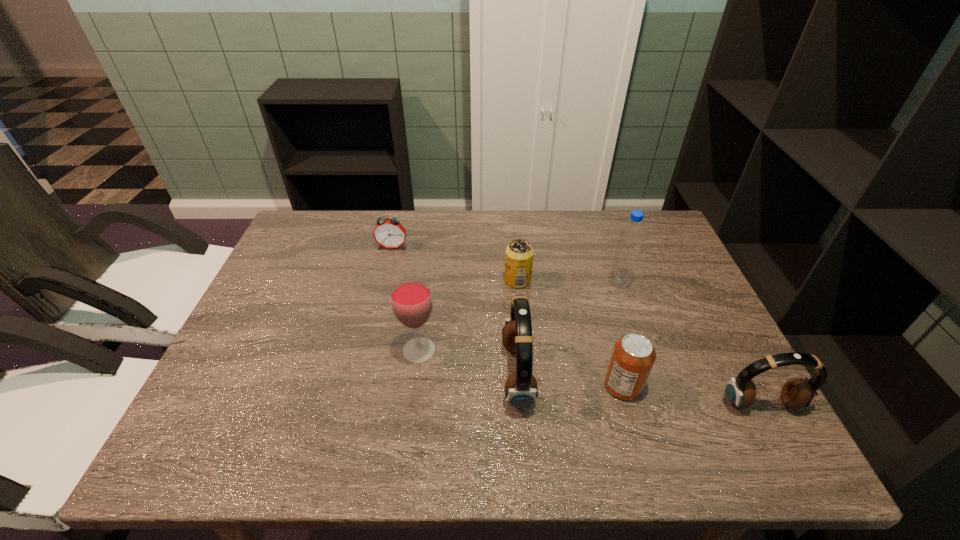
Locate an element on the screen. unoccupied area between the water bottle and the taller headset is located at coordinates (568, 329).

Where is `object that is the third closest to the beer can`? The height and width of the screenshot is (540, 960). object that is the third closest to the beer can is located at coordinates (411, 298).

Locate which object ranks third in proximity to the can. Please provide its 2D coordinates. Your answer should be formatted as a tuple, i.e. [(x, y)], where the tuple contains the x and y coordinates of a point satisfying the conditions above.

[(631, 237)]

The height and width of the screenshot is (540, 960). Find the location of `free space in the image that satisfies the following two spatial constraints: 1. on the clock face of the beer can; 2. on the right side of the alarm clock`. free space in the image that satisfies the following two spatial constraints: 1. on the clock face of the beer can; 2. on the right side of the alarm clock is located at coordinates (384, 280).